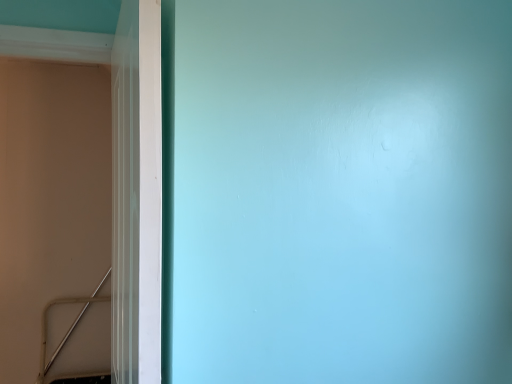
You are a GUI agent. You are given a task and a screenshot of the screen. Output one action in this format:
    pyautogui.click(x=<x>, y=<y>)
    Task: Click on the white glossy door at left
    This screenshot has width=512, height=384.
    Given the screenshot: What is the action you would take?
    pyautogui.click(x=136, y=194)

What do you see at coordinates (136, 194) in the screenshot?
I see `white glossy door at left` at bounding box center [136, 194].

At what (x,y) coordinates should I click in order to perform the action: click on white glossy door at left. Please return your answer as a coordinate pair (x, y). Looking at the image, I should click on (136, 194).